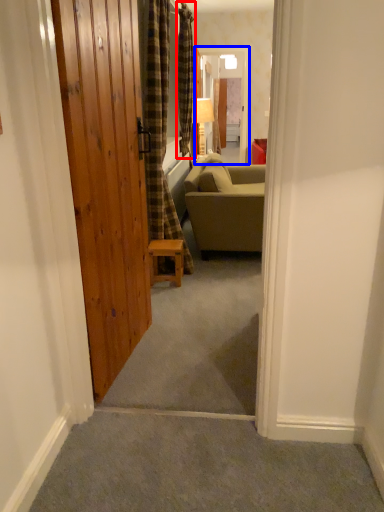
Question: Among these objects, which one is nearest to the camera, curtain (highlighted by a red box) or screen door (highlighted by a blue box)?

Choices:
 (A) curtain
 (B) screen door

Answer: (A)